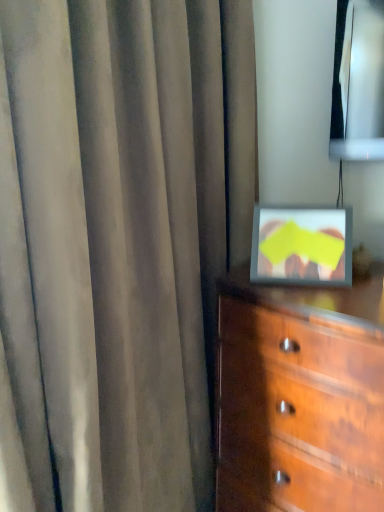
This screenshot has width=384, height=512. What are the coordinates of `satin gray curtain at center` in the screenshot? It's located at (118, 243).

What do you see at coordinates (118, 243) in the screenshot? I see `satin gray curtain at center` at bounding box center [118, 243].

The image size is (384, 512). Describe the element at coordinates (300, 396) in the screenshot. I see `wooden chest of drawers at lower right` at that location.

The width and height of the screenshot is (384, 512). In order to click on wooden chest of drawers at lower right in this screenshot , I will do `click(300, 396)`.

Measure the distance between point (246, 265) and camera.

Point (246, 265) and camera are 4.57 feet apart.

In order to face wooden chest of drawers at lower right, should I rotate leftwards or rightwards?

Turn right approximately 14.955 degrees to face it.

At what (x,y) coordinates should I click in order to perform the action: click on satin gray curtain at center. Please return your answer as a coordinate pair (x, y). The width and height of the screenshot is (384, 512). Looking at the image, I should click on (118, 243).

From the picture: Considering the relative positions of satin gray curtain at center and wooden chest of drawers at lower right in the image provided, is satin gray curtain at center to the left of wooden chest of drawers at lower right from the viewer's perspective?

Indeed, satin gray curtain at center is positioned on the left side of wooden chest of drawers at lower right.

Does satin gray curtain at center lie behind wooden chest of drawers at lower right?

No.

Between point (233, 109) and point (363, 442), which one is positioned behind?

The point (233, 109) is behind.

From the image's perspective, does satin gray curtain at center appear lower than wooden chest of drawers at lower right?

No, from the image's perspective, satin gray curtain at center is not beneath wooden chest of drawers at lower right.

In the scene shown: From a real-world perspective, is satin gray curtain at center physically located above or below wooden chest of drawers at lower right?

In terms of real-world spatial position, satin gray curtain at center is above wooden chest of drawers at lower right.

Consider the image. Can you confirm if satin gray curtain at center is thinner than wooden chest of drawers at lower right?

Correct, the width of satin gray curtain at center is less than that of wooden chest of drawers at lower right.

Who is shorter, satin gray curtain at center or wooden chest of drawers at lower right?

wooden chest of drawers at lower right is shorter.

In the scene shown: Which of these two, satin gray curtain at center or wooden chest of drawers at lower right, is smaller?

wooden chest of drawers at lower right.

Is satin gray curtain at center not inside wooden chest of drawers at lower right?

Yes, satin gray curtain at center is located beyond the bounds of wooden chest of drawers at lower right.

Would you say satin gray curtain at center is a long distance from wooden chest of drawers at lower right?

satin gray curtain at center is actually quite close to wooden chest of drawers at lower right.

Is satin gray curtain at center facing towards wooden chest of drawers at lower right?

Yes, satin gray curtain at center is oriented towards wooden chest of drawers at lower right.

Can you tell me how much satin gray curtain at center and wooden chest of drawers at lower right differ in facing direction?

90.4 degrees.

Locate an element on the screen. This screenshot has height=512, width=384. curtain in front of the wooden chest of drawers at lower right is located at coordinates (118, 243).

Considering the positions of objects wooden chest of drawers at lower right and satin gray curtain at center in the image provided, who is more to the right, wooden chest of drawers at lower right or satin gray curtain at center?

wooden chest of drawers at lower right.

Is the position of wooden chest of drawers at lower right more distant than that of satin gray curtain at center?

Yes, it is behind satin gray curtain at center.

Does point (244, 422) come in front of point (112, 40)?

No.

From the image's perspective, is wooden chest of drawers at lower right positioned above or below satin gray curtain at center?

wooden chest of drawers at lower right is below satin gray curtain at center.

From a real-world perspective, is wooden chest of drawers at lower right over satin gray curtain at center?

No, from a real-world perspective, wooden chest of drawers at lower right is not over satin gray curtain at center

Does wooden chest of drawers at lower right have a greater width compared to satin gray curtain at center?

Yes.

Which of these two, wooden chest of drawers at lower right or satin gray curtain at center, stands shorter?

Standing shorter between the two is wooden chest of drawers at lower right.

Based on their sizes in the image, would you say wooden chest of drawers at lower right is bigger or smaller than satin gray curtain at center?

In the image, wooden chest of drawers at lower right appears to be smaller than satin gray curtain at center.

Is wooden chest of drawers at lower right situated inside satin gray curtain at center or outside?

wooden chest of drawers at lower right is located beyond the bounds of satin gray curtain at center.

Is wooden chest of drawers at lower right not near satin gray curtain at center?

wooden chest of drawers at lower right is actually quite close to satin gray curtain at center.

In the scene shown: Is wooden chest of drawers at lower right facing away from satin gray curtain at center?

That's not correct — wooden chest of drawers at lower right is not looking away from satin gray curtain at center.

Measure the distance from wooden chest of drawers at lower right to satin gray curtain at center.

wooden chest of drawers at lower right and satin gray curtain at center are 14.75 inches apart.

The image size is (384, 512). What are the coordinates of `the chest of drawers that is below the satin gray curtain at center (from the image's perspective)` in the screenshot? It's located at (300, 396).

This screenshot has width=384, height=512. Identify the location of the chest of drawers located behind the satin gray curtain at center. (300, 396).

In order to click on curtain located in front of the wooden chest of drawers at lower right in this screenshot , I will do `click(118, 243)`.